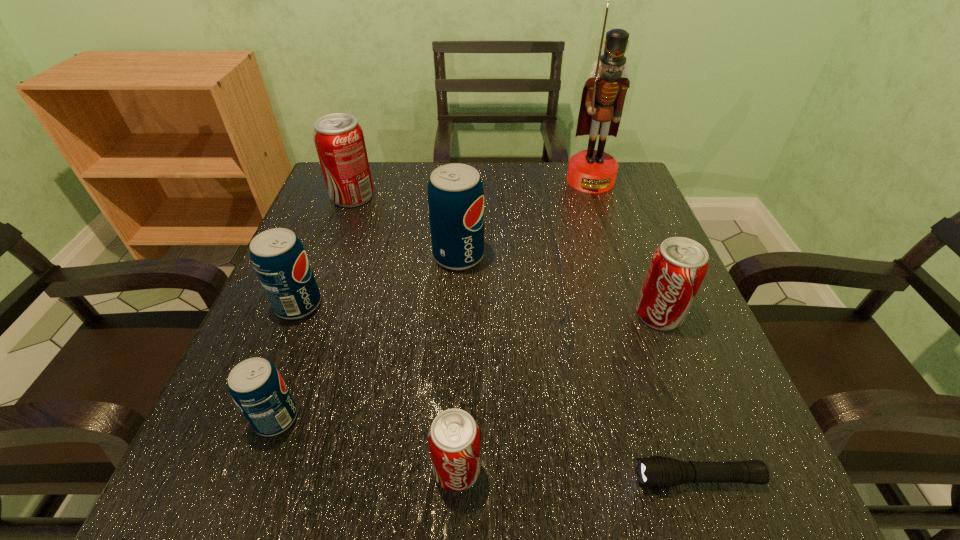
This screenshot has width=960, height=540. Find the location of `the smallest blue pop`. the smallest blue pop is located at coordinates (255, 385).

I want to click on the second red soda can from right to left, so click(x=454, y=438).

At what (x,y) coordinates should I click in order to perform the action: click on the nearest red soda can. Please return your answer as a coordinate pair (x, y). Looking at the image, I should click on 454,438.

Find the location of `the shortest object`. the shortest object is located at coordinates (656, 471).

This screenshot has height=540, width=960. I want to click on free region located on the front-facing side of the nutcracker, so tap(608, 230).

The image size is (960, 540). Find the location of `vacant point located 0.100m on the right of the rightmost blue pop`. vacant point located 0.100m on the right of the rightmost blue pop is located at coordinates (531, 256).

Where is `blank space located on the front of the farthest red soda can`? The image size is (960, 540). blank space located on the front of the farthest red soda can is located at coordinates (310, 312).

This screenshot has width=960, height=540. Identify the location of vacant region located 0.190m on the front of the second smallest blue pop. (253, 418).

This screenshot has height=540, width=960. I want to click on free space located on the left of the rightmost soda can, so click(576, 314).

Find the location of a particular element. The height and width of the screenshot is (540, 960). vacant space situated 0.210m on the back of the third nearest object is located at coordinates 318,301.